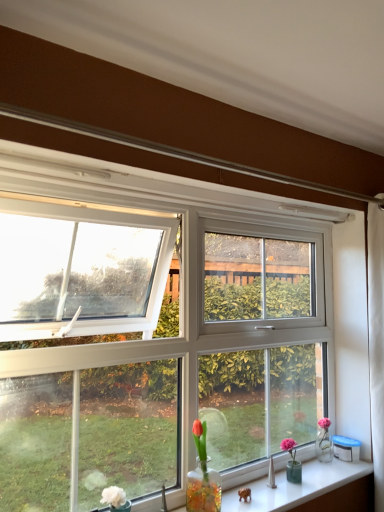
Locate an element on the screen. The height and width of the screenshot is (512, 384). free spot above white glossy window sill at lower right (from a real-world perspective) is located at coordinates (294, 481).